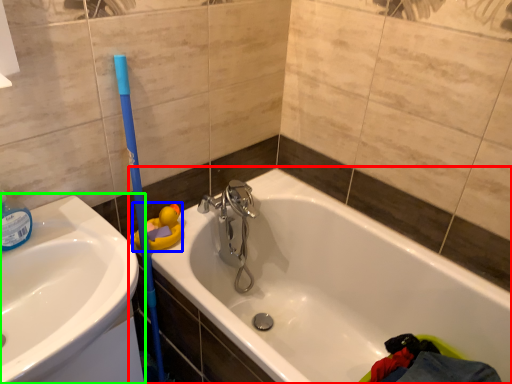
Question: Considering the real-world distances, which object is closest to bathtub (highlighted by a red box)? toy (highlighted by a blue box) or sink (highlighted by a green box).

Choices:
 (A) toy
 (B) sink

Answer: (A)